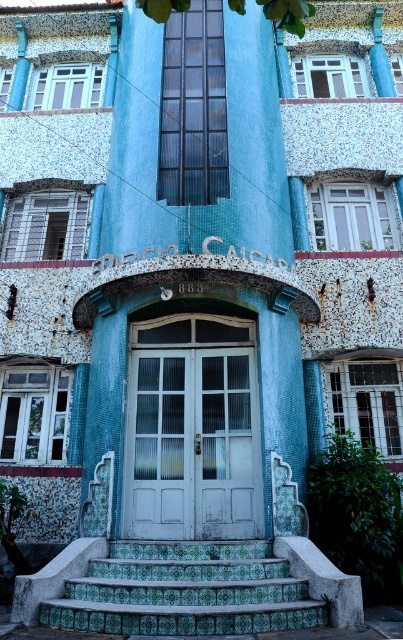
Measure the distance between white matte door at center and camera.

white matte door at center and camera are 6.87 meters apart.

Which is below, white matte door at center or green tile stairs at center?

green tile stairs at center is lower down.

Between point (168, 435) and point (259, 582), which one is positioned in front?

Positioned in front is point (259, 582).

Where is `white matte door at center`? This screenshot has width=403, height=640. white matte door at center is located at coordinates (193, 429).